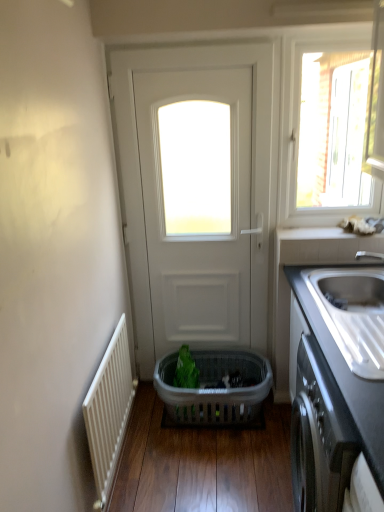
Question: Is black matte cabinet at lower right taller than transparent glass window at upper right?

Choices:
 (A) yes
 (B) no

Answer: (B)

Question: From the image's perspective, is black matte cabinet at lower right located above transparent glass window at upper right?

Choices:
 (A) no
 (B) yes

Answer: (A)

Question: Does black matte cabinet at lower right turn towards transparent glass window at upper right?

Choices:
 (A) no
 (B) yes

Answer: (A)

Question: Considering the relative sizes of black matte cabinet at lower right and transparent glass window at upper right in the image provided, is black matte cabinet at lower right thinner than transparent glass window at upper right?

Choices:
 (A) yes
 (B) no

Answer: (B)

Question: From a real-world perspective, is black matte cabinet at lower right physically above transparent glass window at upper right?

Choices:
 (A) no
 (B) yes

Answer: (A)

Question: Is translucent plastic basket at center in front of or behind white ribbed radiator at left in the image?

Choices:
 (A) behind
 (B) front

Answer: (A)

Question: Considering the positions of translucent plastic basket at center and white ribbed radiator at left in the image, is translucent plastic basket at center wider or thinner than white ribbed radiator at left?

Choices:
 (A) wide
 (B) thin

Answer: (A)

Question: Visually, is translucent plastic basket at center positioned to the left or to the right of white ribbed radiator at left?

Choices:
 (A) left
 (B) right

Answer: (B)

Question: From the image's perspective, is translucent plastic basket at center above or below white ribbed radiator at left?

Choices:
 (A) below
 (B) above

Answer: (A)

Question: Is point (175, 375) positioned closer to the camera than point (375, 309)?

Choices:
 (A) farther
 (B) closer

Answer: (A)

Question: From the image's perspective, is green plastic basket at center above or below satin steel sink at right?

Choices:
 (A) above
 (B) below

Answer: (B)

Question: From a real-world perspective, is green plastic basket at center physically located above or below satin steel sink at right?

Choices:
 (A) above
 (B) below

Answer: (B)

Question: In the image, is green plastic basket at center positioned in front of or behind satin steel sink at right?

Choices:
 (A) behind
 (B) front

Answer: (A)

Question: In the image, is satin steel sink at right positioned in front of or behind white ceramic window sill at upper right?

Choices:
 (A) behind
 (B) front

Answer: (B)

Question: From the image's perspective, relative to white ceramic window sill at upper right, is satin steel sink at right above or below?

Choices:
 (A) above
 (B) below

Answer: (B)